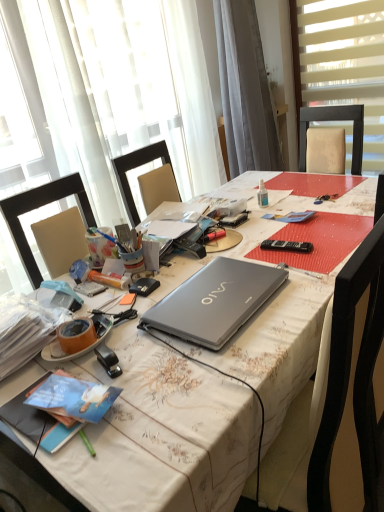
You are a GUI agent. You are given a task and a screenshot of the screen. Output one action in this format:
    pyautogui.click(x=<x>, y=<y>)
    Task: Click on the vacant space in front of black plastic remote control at center
    This screenshot has height=512, width=384.
    Given the screenshot: What is the action you would take?
    pyautogui.click(x=302, y=266)